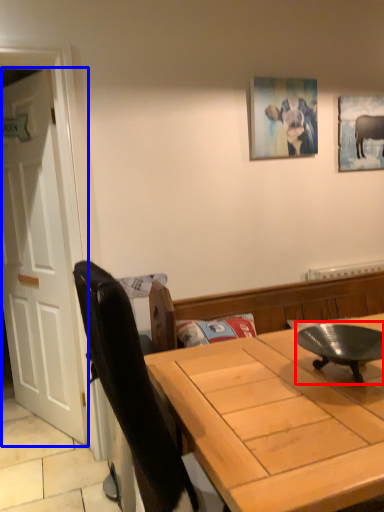
Question: Which object appears closest to the camera in this image, round table (highlighted by a red box) or door (highlighted by a blue box)?

Choices:
 (A) round table
 (B) door

Answer: (A)